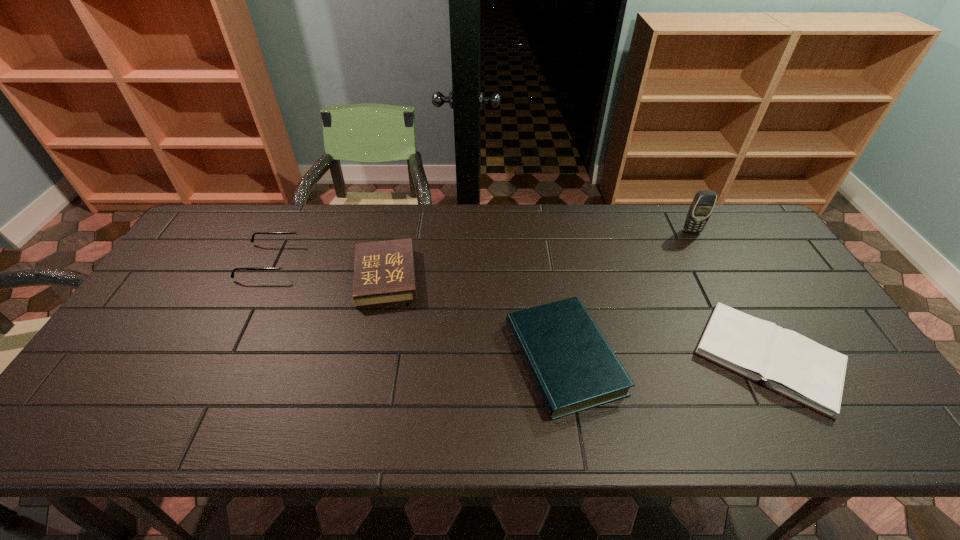
Locate an element on the screen. The width and height of the screenshot is (960, 540). free space that satisfies the following two spatial constraints: 1. at the hinge ends of the leftmost hardback book; 2. on the left side of the spectacles is located at coordinates (262, 277).

Locate an element on the screen. This screenshot has width=960, height=540. free space that satisfies the following two spatial constraints: 1. at the hinge ends of the rightmost hardback book; 2. on the left side of the leftmost object is located at coordinates (223, 357).

Identify the location of blank space that satisfies the following two spatial constraints: 1. at the hinge ends of the leftmost hardback book; 2. on the left side of the leftmost object. (262, 277).

You are a GUI agent. You are given a task and a screenshot of the screen. Output one action in this format:
    pyautogui.click(x=<x>, y=<y>)
    Task: Click on the vacant space that satisfies the following two spatial constraints: 1. on the back side of the leftmost hardback book; 2. at the hinge ends of the spectacles
    
    Given the screenshot: What is the action you would take?
    pyautogui.click(x=390, y=262)

Where is `vacant region that satisfies the following two spatial constraints: 1. at the hinge ends of the leftmost object; 2. on the left side of the shortest object`? The width and height of the screenshot is (960, 540). vacant region that satisfies the following two spatial constraints: 1. at the hinge ends of the leftmost object; 2. on the left side of the shortest object is located at coordinates (223, 357).

Locate an element on the screen. Image resolution: width=960 pixels, height=540 pixels. free space in the image that satisfies the following two spatial constraints: 1. on the front side of the fourth object from right to left; 2. on the left side of the shortest hardback book is located at coordinates (369, 357).